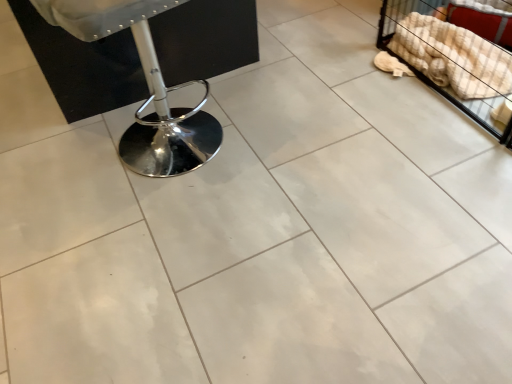
Locate an element on the screen. This screenshot has height=384, width=512. free space to the right of chrome metallic swivel chair at left is located at coordinates (286, 124).